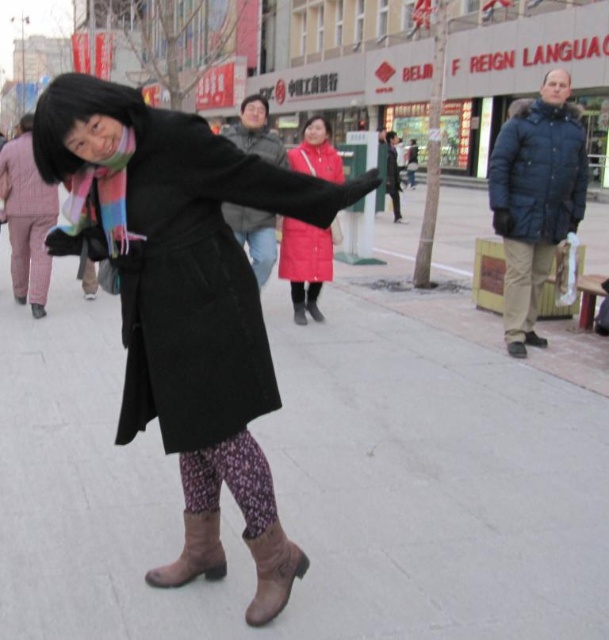
Question: Which object is the closest to the plaid fabric pants at left?

Choices:
 (A) brown suede boot at lower center
 (B) red matte coat at center
 (C) light pink plaid pants at left
 (D) khaki cotton pants at right

Answer: (C)

Question: Is the position of matte black coat at center less distant than that of khaki cotton pants at right?

Choices:
 (A) yes
 (B) no

Answer: (A)

Question: Can you confirm if brown suede boot at lower center is positioned below plaid fabric pants at left?

Choices:
 (A) no
 (B) yes

Answer: (B)

Question: Which of the following is the closest to the observer?

Choices:
 (A) (24, 186)
 (B) (52, 202)
 (C) (100, 243)

Answer: (C)

Question: In this image, where is light pink fabric coat at left located relative to dark gray wool coat at center?

Choices:
 (A) above
 (B) below

Answer: (A)

Question: Considering the real-world distances, which object is farthest from the light pink plaid pants at left?

Choices:
 (A) matte black coat at center
 (B) plaid fabric pants at left

Answer: (A)